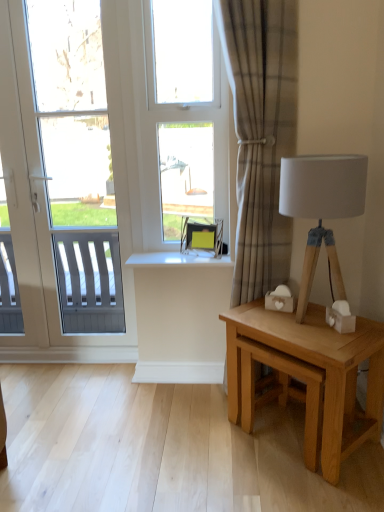
You are a GUI agent. You are given a task and a screenshot of the screen. Output one action in this format:
    pyautogui.click(x=<x>, y=<y>)
    Task: Click on the vacant space in front of light brown wooden table at right
    The image size is (384, 512).
    Given the screenshot: What is the action you would take?
    pyautogui.click(x=302, y=487)